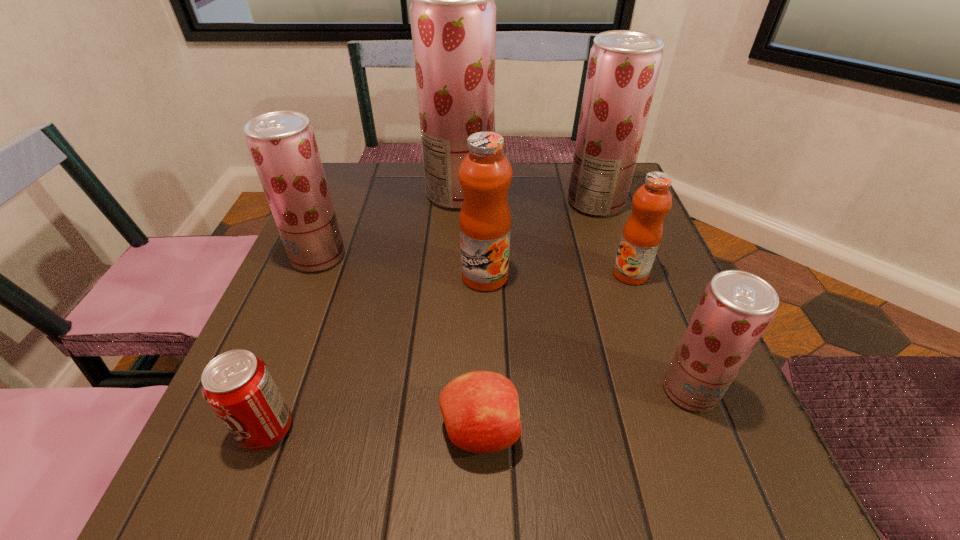
In order to click on the tallest object in this screenshot , I will do `click(453, 15)`.

Where is `the third strawberry fruit juice from right to left`? the third strawberry fruit juice from right to left is located at coordinates (453, 15).

I want to click on the second tallest fruit juice, so click(x=623, y=68).

Locate an element on the screen. the second biggest strawberry fruit juice is located at coordinates (623, 68).

Image resolution: width=960 pixels, height=540 pixels. I want to click on the leftmost strawberry fruit juice, so click(x=282, y=144).

Identify the location of the second smallest strawberry fruit juice. The image size is (960, 540). (282, 144).

Find the location of a particular element. the bigger orange fruit juice is located at coordinates (485, 174).

Image resolution: width=960 pixels, height=540 pixels. What are the coordinates of `the smaller orange fruit juice` in the screenshot? It's located at (642, 233).

I want to click on the nearest strawberry fruit juice, so click(736, 307).

You are a GUI agent. You are given a task and a screenshot of the screen. Output one action in this format:
    pyautogui.click(x=<x>, y=<y>)
    Task: Click on the nearest fruit juice
    This screenshot has height=540, width=960.
    Given the screenshot: What is the action you would take?
    pyautogui.click(x=736, y=307)